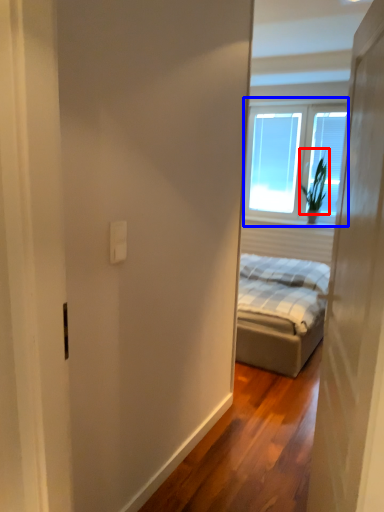
Question: Which point is closer to the camera, plant (highlighted by a red box) or window (highlighted by a blue box)?

Choices:
 (A) plant
 (B) window

Answer: (B)